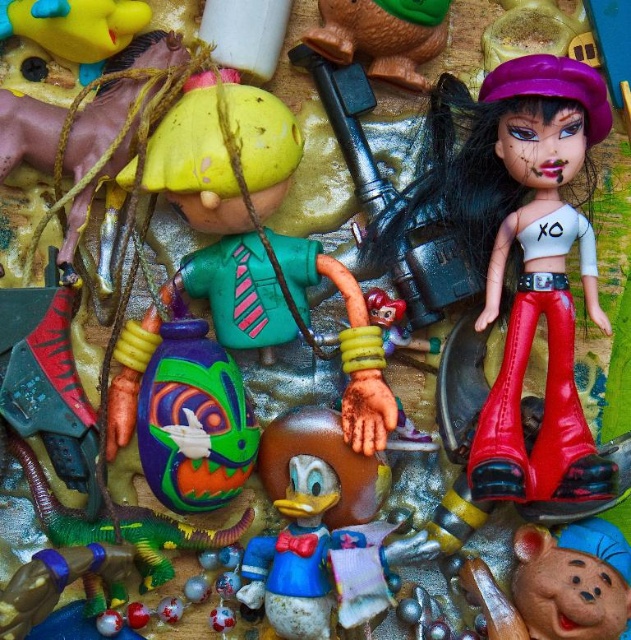
Describe the element at coordinates (507, 156) in the screenshot. This screenshot has width=631, height=640. I see `shiny red leather pants at right` at that location.

Does shiny red leather pants at right have a smaller size compared to rubber duck at upper center?

No.

Is point (543, 445) farther from camera compared to point (319, 51)?

That is False.

You are a GUI agent. You are given a task and a screenshot of the screen. Output one action in this format:
    pyautogui.click(x=<x>, y=<y>)
    Task: Click on the shiny red leather pants at right
    The height and width of the screenshot is (640, 631).
    Given the screenshot: What is the action you would take?
    click(507, 156)

What do you see at coordinates (507, 156) in the screenshot? I see `shiny red leather pants at right` at bounding box center [507, 156].

Does shiny red leather pants at right appear on the left side of smooth brown bear at center?

Indeed, shiny red leather pants at right is positioned on the left side of smooth brown bear at center.

The width and height of the screenshot is (631, 640). Identify the location of shiny red leather pants at right. (507, 156).

Between smooth brown bear at center and rubber duck at upper center, which one has less height?

Standing shorter between the two is rubber duck at upper center.

Can you confirm if smooth brown bear at center is thinner than rubber duck at upper center?

In fact, smooth brown bear at center might be wider than rubber duck at upper center.

Does point (599, 552) lie behind point (363, 26)?

No, it is in front of (363, 26).

I want to click on smooth brown bear at center, so click(x=558, y=586).